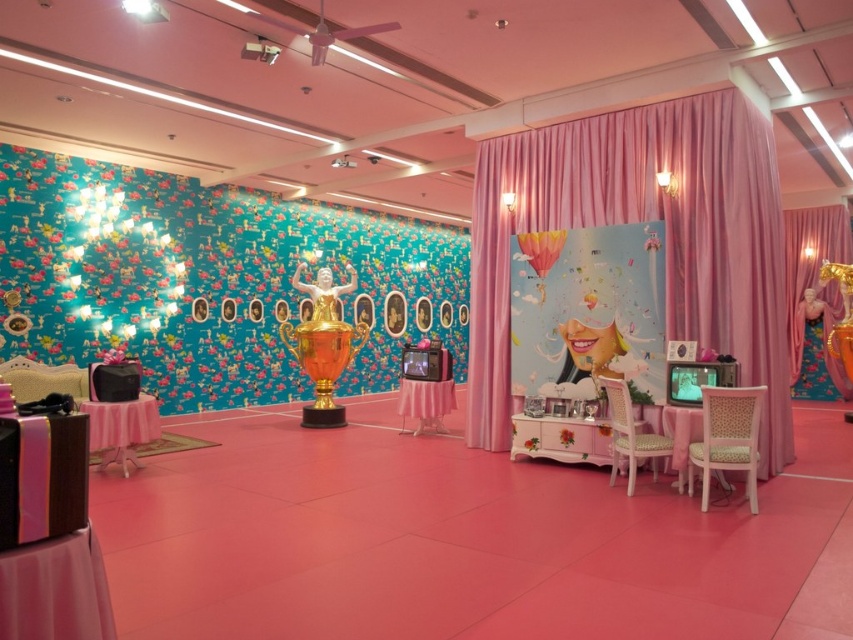
Who is lower down, velvet pink curtain at center or matte pink chair at lower right?

matte pink chair at lower right is lower down.

This screenshot has width=853, height=640. What do you see at coordinates (637, 220) in the screenshot?
I see `velvet pink curtain at center` at bounding box center [637, 220].

Find the location of `velvet pink curtain at center`. velvet pink curtain at center is located at coordinates (637, 220).

Based on the photo, can you confirm if matte pink chair at lower right is thinner than matte pink balloon at center?

No, matte pink chair at lower right is not thinner than matte pink balloon at center.

How far apart are matte pink chair at lower right and matte pink balloon at center?

matte pink chair at lower right and matte pink balloon at center are 1.82 meters apart from each other.

Which is behind, point (631, 472) or point (544, 243)?

Positioned behind is point (544, 243).

Where is `matte pink chair at lower right`? The width and height of the screenshot is (853, 640). matte pink chair at lower right is located at coordinates click(x=630, y=435).

Which is above, velvet pink curtain at center or wooden chair at lower right?

velvet pink curtain at center

Is velvet pink curtain at center positioned in front of wooden chair at lower right?

No.

Is point (670, 227) positioned before point (722, 438)?

No, (670, 227) is behind (722, 438).

Image resolution: width=853 pixels, height=640 pixels. I want to click on velvet pink curtain at center, so click(x=637, y=220).